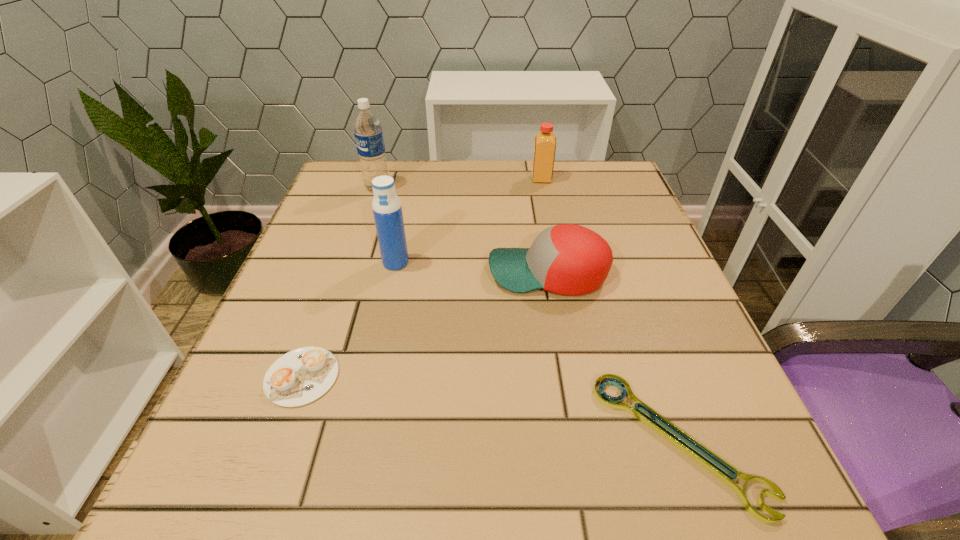
The width and height of the screenshot is (960, 540). I want to click on vacant area at the far left corner of the desktop, so click(336, 181).

The height and width of the screenshot is (540, 960). In the image, there is a desktop. Identify the location of vacant space at the far right corner. (590, 204).

This screenshot has width=960, height=540. What are the coordinates of `free spot between the orange juice and the right water bottle` in the screenshot? It's located at (468, 221).

You are a GUI agent. You are given a task and a screenshot of the screen. Output one action in this format:
    pyautogui.click(x=<x>, y=<y>)
    Task: Click on the vacant area that lies between the cappuccino and the shorter water bottle
    The height and width of the screenshot is (540, 960).
    Given the screenshot: What is the action you would take?
    pyautogui.click(x=348, y=320)

You are a GUI agent. You are given a task and a screenshot of the screen. Output one action in this format:
    pyautogui.click(x=<x>, y=<y>)
    Task: Click on the unoccupied area between the baseball cap and the wrench
    This screenshot has height=540, width=960.
    Given the screenshot: What is the action you would take?
    pyautogui.click(x=613, y=357)

Identify the location of blank region between the baseball cap and the right water bottle. The width and height of the screenshot is (960, 540). (472, 268).

Where is `free space between the shortest object and the fifth shortest object`? free space between the shortest object and the fifth shortest object is located at coordinates (538, 352).

Locate an element on the screen. The image size is (960, 540). empty space that is in between the farther water bottle and the third shortest object is located at coordinates point(463,231).

At what (x,y) coordinates should I click in order to perform the action: click on free area in between the second shortest object and the baseball cap. Please return your answer as a coordinate pair (x, y). This screenshot has height=540, width=960. Looking at the image, I should click on (425, 325).

The image size is (960, 540). I want to click on blank region between the nearer water bottle and the orange juice, so click(468, 221).